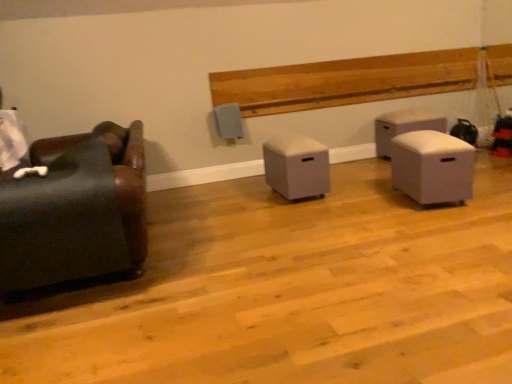
Question: Considering the relative positions of white fabric ottoman at right, the fourth furniture positioned from the left, and beige fabric ottoman at center, which is the third furniture in front-to-back order, in the image provided, is white fabric ottoman at right, the fourth furniture positioned from the left, behind beige fabric ottoman at center, which is the third furniture in front-to-back order,?

Choices:
 (A) no
 (B) yes

Answer: (B)

Question: Considering the relative sizes of white fabric ottoman at right, which appears as the fourth furniture when viewed from the front, and beige fabric ottoman at center, the 3th furniture when ordered from right to left, in the image provided, is white fabric ottoman at right, which appears as the fourth furniture when viewed from the front, wider than beige fabric ottoman at center, the 3th furniture when ordered from right to left,?

Choices:
 (A) yes
 (B) no

Answer: (B)

Question: Does white fabric ottoman at right, the 1th furniture in the right-to-left sequence, turn towards beige fabric ottoman at center, which appears as the second furniture when viewed from the back?

Choices:
 (A) no
 (B) yes

Answer: (A)

Question: Is the position of white fabric ottoman at right, the fourth furniture positioned from the left, less distant than that of beige fabric ottoman at center, the second furniture in the left-to-right sequence?

Choices:
 (A) yes
 (B) no

Answer: (B)

Question: Can you confirm if white fabric ottoman at right, which is the 1th furniture from back to front, is taller than beige fabric ottoman at center, which appears as the second furniture when viewed from the back?

Choices:
 (A) yes
 (B) no

Answer: (A)

Question: Considering the positions of light brown wood paneling at upper center and white fabric ottoman at right, acting as the third furniture starting from the left, in the image, is light brown wood paneling at upper center taller or shorter than white fabric ottoman at right, acting as the third furniture starting from the left,?

Choices:
 (A) tall
 (B) short

Answer: (B)

Question: Visually, is light brown wood paneling at upper center positioned to the left or to the right of white fabric ottoman at right, acting as the third furniture starting from the left?

Choices:
 (A) left
 (B) right

Answer: (A)

Question: Does point (329, 82) appear closer or farther from the camera than point (432, 157)?

Choices:
 (A) closer
 (B) farther

Answer: (B)

Question: Looking at the image, does light brown wood paneling at upper center seem bigger or smaller compared to white fabric ottoman at right, the second furniture positioned from the front?

Choices:
 (A) small
 (B) big

Answer: (B)

Question: Considering the positions of point (34, 241) and point (450, 173), is point (34, 241) closer or farther from the camera than point (450, 173)?

Choices:
 (A) closer
 (B) farther

Answer: (A)

Question: In the image, is leather couch at left, which is the first furniture in left-to-right order, positioned in front of or behind white fabric ottoman at right, the second furniture positioned from the front?

Choices:
 (A) front
 (B) behind

Answer: (A)

Question: Considering the positions of leather couch at left, the 4th furniture viewed from the right, and white fabric ottoman at right, the second furniture positioned from the front, in the image, is leather couch at left, the 4th furniture viewed from the right, taller or shorter than white fabric ottoman at right, the second furniture positioned from the front,?

Choices:
 (A) short
 (B) tall

Answer: (B)

Question: From the image's perspective, relative to white fabric ottoman at right, which ranks as the third furniture in back-to-front order, is leather couch at left, the 4th furniture viewed from the right, above or below?

Choices:
 (A) above
 (B) below

Answer: (B)

Question: From a real-world perspective, is white fabric ottoman at right, the 1th furniture in the right-to-left sequence, positioned above or below white fabric ottoman at right, which ranks as the third furniture in back-to-front order?

Choices:
 (A) above
 (B) below

Answer: (A)

Question: Considering their positions, is white fabric ottoman at right, which appears as the fourth furniture when viewed from the front, located in front of or behind white fabric ottoman at right, which is the 2th furniture in right-to-left order?

Choices:
 (A) behind
 (B) front

Answer: (A)